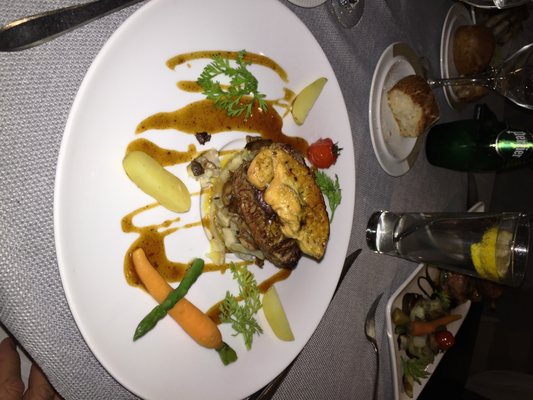
The width and height of the screenshot is (533, 400). In order to click on large plate in this screenshot , I will do `click(297, 44)`.